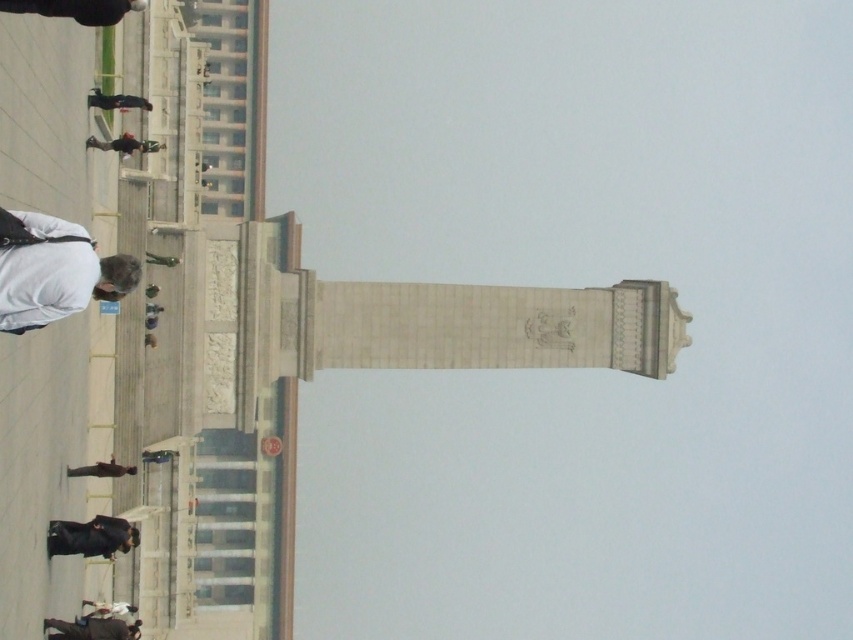
You are standing in the public square and see both the black rubber skateboard at lower left and the green fabric person at lower left. Which object is positioned further to the left?

The black rubber skateboard at lower left is positioned to the left of the green fabric person at lower left, so it is further to the left.

You are standing at the point marked by the coordinates point (91, 536), which is the black rubber skateboard at lower left. You want to walk towards the monument in the center. Which direction should you move?

Since the point (91, 536) corresponds to the black rubber skateboard at lower left, you should move towards the center to reach the monument.